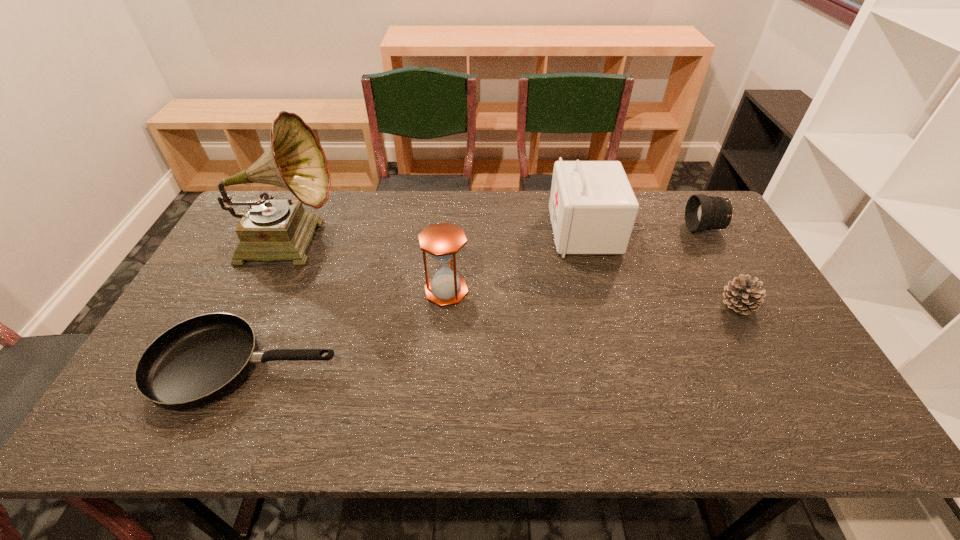
The image size is (960, 540). Identify the location of vacant position located on the front-facing side of the fourth object from left to right. (467, 232).

Where is `free point located 0.260m on the front-facing side of the fourth object from left to right`? The width and height of the screenshot is (960, 540). free point located 0.260m on the front-facing side of the fourth object from left to right is located at coordinates (472, 232).

Image resolution: width=960 pixels, height=540 pixels. In order to click on free region located on the front-facing side of the fourth object from left to right in this screenshot , I will do `click(521, 232)`.

The image size is (960, 540). I want to click on vacant area situated 0.200m on the right of the hourglass, so click(539, 291).

Locate an element on the screen. free space located at the front element of the third shortest object is located at coordinates (620, 228).

Find the location of a particular element. This screenshot has height=540, width=960. vacant point located at the front element of the third shortest object is located at coordinates (620, 228).

This screenshot has width=960, height=540. I want to click on vacant space located 0.260m at the front element of the third shortest object, so click(608, 228).

Find the location of a particular element. Image resolution: width=960 pixels, height=540 pixels. free space located 0.320m on the back of the second shortest object is located at coordinates (692, 222).

The image size is (960, 540). I want to click on vacant region located at the end of the handle of the frying pan, so click(x=372, y=366).

Where is `record player present at the far edge`? record player present at the far edge is located at coordinates (269, 230).